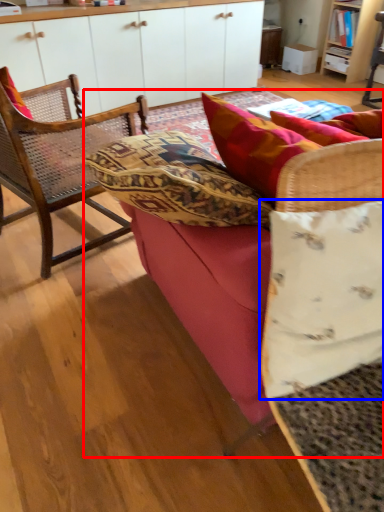
Question: Which point is further to the camera, studio couch (highlighted by a red box) or pillow (highlighted by a blue box)?

Choices:
 (A) studio couch
 (B) pillow

Answer: (A)